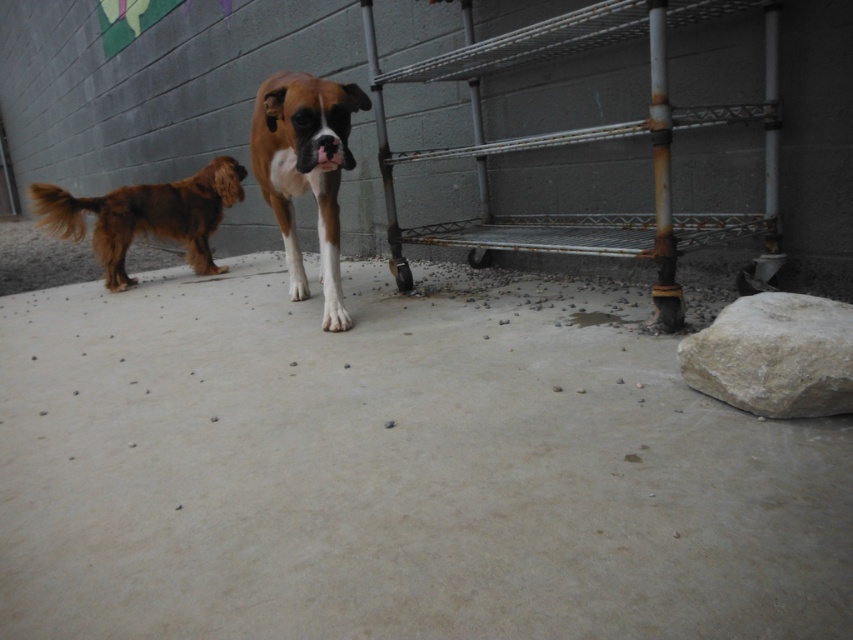
Can you confirm if rusty metal rack at lower right is smaller than white rough rock at right?

Actually, rusty metal rack at lower right might be larger than white rough rock at right.

Is point (483, 195) positioned after point (782, 388)?

Yes, it is.

This screenshot has width=853, height=640. In order to click on rusty metal rack at lower right in this screenshot , I will do `click(585, 141)`.

Looking at this image, is white rough rock at right shorter than brown matte dog at center?

Correct, white rough rock at right is not as tall as brown matte dog at center.

Does white rough rock at right appear over brown matte dog at center?

Incorrect, white rough rock at right is not positioned above brown matte dog at center.

Which is in front, point (787, 342) or point (320, 256)?

Point (787, 342) is in front.

At what (x,y) coordinates should I click in order to perform the action: click on white rough rock at right. Please return your answer as a coordinate pair (x, y). Image resolution: width=853 pixels, height=640 pixels. Looking at the image, I should click on (775, 355).

Is rusty metal rack at lower right to the right of shiny brown fur at left from the viewer's perspective?

Indeed, rusty metal rack at lower right is positioned on the right side of shiny brown fur at left.

Does point (495, 230) come farther from viewer compared to point (241, 200)?

No, (495, 230) is in front of (241, 200).

This screenshot has width=853, height=640. I want to click on rusty metal rack at lower right, so click(x=585, y=141).

Locate an element on the screen. The width and height of the screenshot is (853, 640). rusty metal rack at lower right is located at coordinates (585, 141).